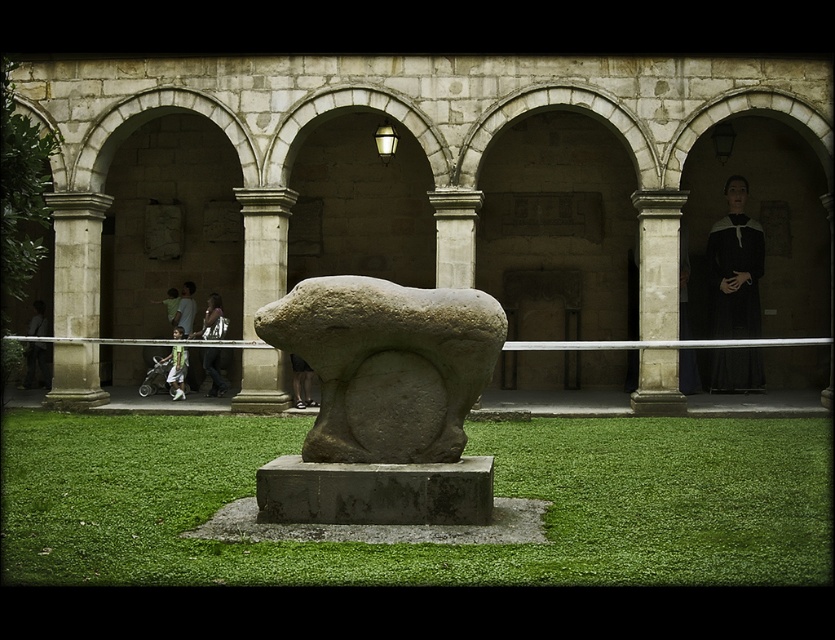
Between gray stone pillar at center and black woolen robe at right, which one is positioned lower?

Positioned lower is gray stone pillar at center.

Is point (274, 280) farther from viewer compared to point (709, 301)?

No, (274, 280) is in front of (709, 301).

Identify the location of gray stone pillar at center. (262, 248).

Which of these two, stone column at right or dark gray stone statue at center, stands taller?

stone column at right

Can you confirm if stone column at right is positioned to the right of dark gray stone statue at center?

Yes, stone column at right is to the right of dark gray stone statue at center.

Which is in front, point (672, 326) or point (297, 360)?

Point (672, 326)

The width and height of the screenshot is (835, 640). What are the coordinates of `stone column at right` in the screenshot? It's located at (658, 262).

Between point (72, 314) and point (219, 358), which one is positioned in front?

Point (72, 314) is in front.

Does smooth stone column at left have a larger size compared to green fabric pants at center?

Correct, smooth stone column at left is larger in size than green fabric pants at center.

Who is more forward, (77,342) or (226,323)?

Point (77,342)

In order to click on smooth stone column at left in this screenshot , I will do `click(76, 260)`.